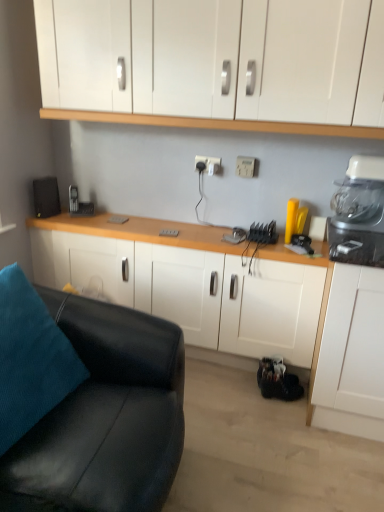
The image size is (384, 512). In order to click on free space in front of yellow matte plastic container at right in this screenshot , I will do `click(291, 248)`.